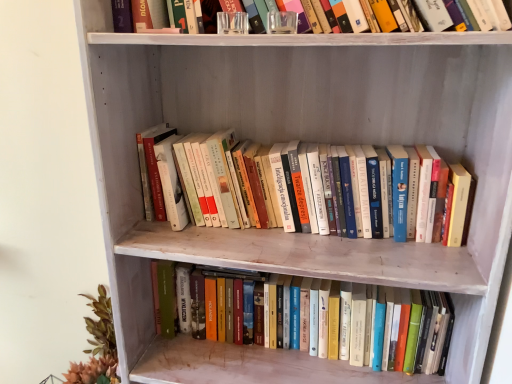
Describe the element at coordinates (287, 190) in the screenshot. This screenshot has height=384, width=512. I see `hardcover books at center, the 2th book ordered from the bottom` at that location.

You are a GUI agent. You are given a task and a screenshot of the screen. Output one action in this format:
    pyautogui.click(x=<x>, y=<y>)
    Task: Click on the hardcover books at center, the 2th book ordered from the bottom
    The height and width of the screenshot is (384, 512).
    Given the screenshot: What is the action you would take?
    pyautogui.click(x=287, y=190)

The image size is (512, 384). In order to click on hardcover books at center, the 2th book in the top-to-bottom sequence in this screenshot , I will do `click(253, 361)`.

This screenshot has height=384, width=512. What do you see at coordinates (253, 361) in the screenshot?
I see `hardcover books at center, which is the first book in bottom-to-top order` at bounding box center [253, 361].

Where is `hardcover books at center, the 1th book in the top-to-bottom sequence`? hardcover books at center, the 1th book in the top-to-bottom sequence is located at coordinates (287, 190).

Considering the relative positions of hardcover books at center, which is the first book in bottom-to-top order, and hardcover books at center, the 1th book in the top-to-bottom sequence, in the image provided, is hardcover books at center, which is the first book in bottom-to-top order, to the left of hardcover books at center, the 1th book in the top-to-bottom sequence, from the viewer's perspective?

No, hardcover books at center, which is the first book in bottom-to-top order, is not to the left of hardcover books at center, the 1th book in the top-to-bottom sequence.

Is hardcover books at center, which is the first book in bottom-to-top order, closer to the viewer compared to hardcover books at center, the 1th book in the top-to-bottom sequence?

No, hardcover books at center, which is the first book in bottom-to-top order, is further to the viewer.

Is point (160, 371) farther from viewer compared to point (374, 206)?

Yes, point (160, 371) is behind point (374, 206).

From the image's perspective, is hardcover books at center, which is the first book in bottom-to-top order, over hardcover books at center, the 2th book ordered from the bottom?

Incorrect, from the image's perspective, hardcover books at center, which is the first book in bottom-to-top order, is lower than hardcover books at center, the 2th book ordered from the bottom.

From a real-world perspective, is hardcover books at center, which is the first book in bottom-to-top order, physically located above or below hardcover books at center, the 1th book in the top-to-bottom sequence?

In terms of real-world spatial position, hardcover books at center, which is the first book in bottom-to-top order, is below hardcover books at center, the 1th book in the top-to-bottom sequence.

Considering the sizes of objects hardcover books at center, which is the first book in bottom-to-top order, and hardcover books at center, the 1th book in the top-to-bottom sequence, in the image provided, who is wider, hardcover books at center, which is the first book in bottom-to-top order, or hardcover books at center, the 1th book in the top-to-bottom sequence,?

hardcover books at center, the 1th book in the top-to-bottom sequence, is wider.

Does hardcover books at center, the 2th book in the top-to-bottom sequence, have a lesser height compared to hardcover books at center, the 2th book ordered from the bottom?

No.

Which of these two, hardcover books at center, which is the first book in bottom-to-top order, or hardcover books at center, the 1th book in the top-to-bottom sequence, is smaller?

Smaller between the two is hardcover books at center, which is the first book in bottom-to-top order.

Based on the photo, is hardcover books at center, which is the first book in bottom-to-top order, inside or outside of hardcover books at center, the 1th book in the top-to-bottom sequence?

hardcover books at center, which is the first book in bottom-to-top order, is spatially situated outside hardcover books at center, the 1th book in the top-to-bottom sequence.

Is hardcover books at center, the 2th book in the top-to-bottom sequence, next to hardcover books at center, the 2th book ordered from the bottom, and touching it?

No, hardcover books at center, the 2th book in the top-to-bottom sequence, is not beside hardcover books at center, the 2th book ordered from the bottom.

Could you tell me if hardcover books at center, the 2th book in the top-to-bottom sequence, is turned towards hardcover books at center, the 2th book ordered from the bottom?

No, hardcover books at center, the 2th book in the top-to-bottom sequence, is not turned towards hardcover books at center, the 2th book ordered from the bottom.

Consider the image. Can you tell me how much hardcover books at center, which is the first book in bottom-to-top order, and hardcover books at center, the 1th book in the top-to-bottom sequence, differ in facing direction?

The angular difference between hardcover books at center, which is the first book in bottom-to-top order, and hardcover books at center, the 1th book in the top-to-bottom sequence, is 0.49 degrees.

Where is `book that appears on the left of hardcover books at center, which is the first book in bottom-to-top order`? book that appears on the left of hardcover books at center, which is the first book in bottom-to-top order is located at coordinates (287, 190).

Would you say hardcover books at center, the 2th book ordered from the bottom, is to the left or to the right of hardcover books at center, which is the first book in bottom-to-top order, in the picture?

Based on their positions, hardcover books at center, the 2th book ordered from the bottom, is located to the left of hardcover books at center, which is the first book in bottom-to-top order.

Relative to hardcover books at center, which is the first book in bottom-to-top order, is hardcover books at center, the 1th book in the top-to-bottom sequence, in front or behind?

In the image, hardcover books at center, the 1th book in the top-to-bottom sequence, appears in front of hardcover books at center, which is the first book in bottom-to-top order.

Between point (277, 194) and point (355, 380), which one is positioned behind?

Point (355, 380)

From the image's perspective, does hardcover books at center, the 1th book in the top-to-bottom sequence, appear higher than hardcover books at center, which is the first book in bottom-to-top order?

Yes.

From a real-world perspective, which object rests below the other?

hardcover books at center, the 2th book in the top-to-bottom sequence.

Considering the sizes of objects hardcover books at center, the 1th book in the top-to-bottom sequence, and hardcover books at center, which is the first book in bottom-to-top order, in the image provided, who is thinner, hardcover books at center, the 1th book in the top-to-bottom sequence, or hardcover books at center, which is the first book in bottom-to-top order,?

Thinner between the two is hardcover books at center, which is the first book in bottom-to-top order.

In terms of height, does hardcover books at center, the 2th book ordered from the bottom, look taller or shorter compared to hardcover books at center, the 2th book in the top-to-bottom sequence?

hardcover books at center, the 2th book ordered from the bottom, is shorter than hardcover books at center, the 2th book in the top-to-bottom sequence.

From the picture: Is hardcover books at center, the 2th book ordered from the bottom, bigger or smaller than hardcover books at center, which is the first book in bottom-to-top order?

In the image, hardcover books at center, the 2th book ordered from the bottom, appears to be larger than hardcover books at center, which is the first book in bottom-to-top order.

Would you say hardcover books at center, the 2th book in the top-to-bottom sequence, is part of hardcover books at center, the 2th book ordered from the bottom,'s contents?

No, hardcover books at center, the 2th book in the top-to-bottom sequence, is located outside of hardcover books at center, the 2th book ordered from the bottom.

Is there a large distance between hardcover books at center, the 2th book ordered from the bottom, and hardcover books at center, the 2th book in the top-to-bottom sequence?

No, hardcover books at center, the 2th book ordered from the bottom, is in close proximity to hardcover books at center, the 2th book in the top-to-bottom sequence.

Could you tell me if hardcover books at center, the 1th book in the top-to-bottom sequence, is turned towards hardcover books at center, the 2th book in the top-to-bottom sequence?

No, hardcover books at center, the 1th book in the top-to-bottom sequence, is not oriented towards hardcover books at center, the 2th book in the top-to-bottom sequence.

The width and height of the screenshot is (512, 384). Identify the location of book above the hardcover books at center, the 2th book in the top-to-bottom sequence (from the image's perspective). 287,190.

Where is `book above the hardcover books at center, the 2th book in the top-to-bottom sequence (from the image's perspective)`? The image size is (512, 384). book above the hardcover books at center, the 2th book in the top-to-bottom sequence (from the image's perspective) is located at coordinates tap(287, 190).

Locate an element on the screen. This screenshot has height=384, width=512. book behind the hardcover books at center, the 2th book ordered from the bottom is located at coordinates (253, 361).